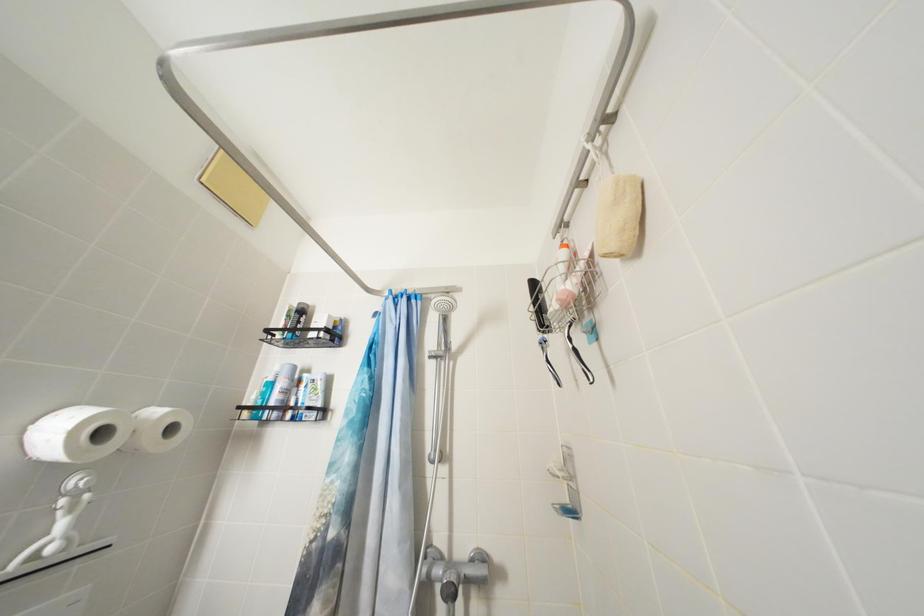
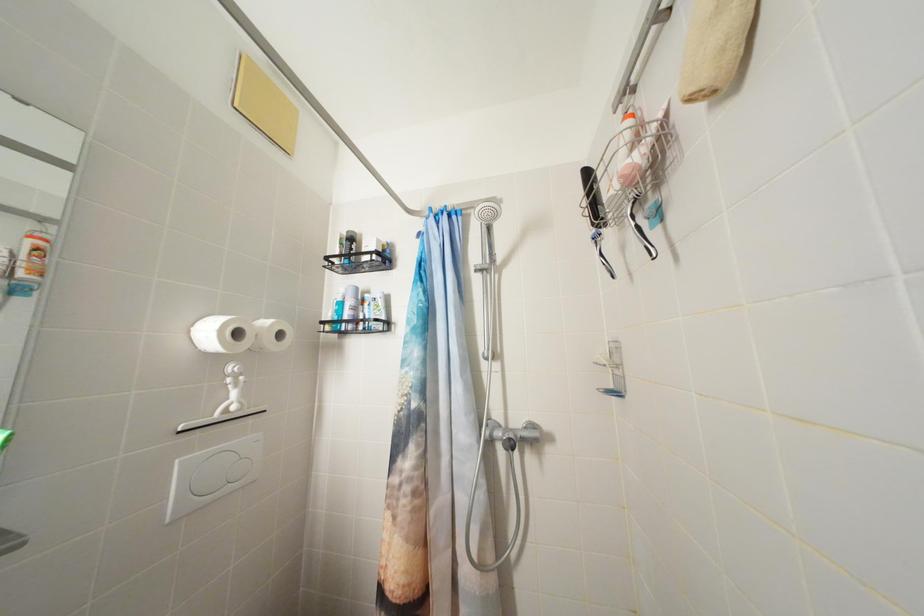
Question: Based on the continuous images, in which direction is the camera rotating? Reply with the corresponding letter.

Choices:
 (A) Left
 (B) Right
 (C) Up
 (D) Down

Answer: (D)